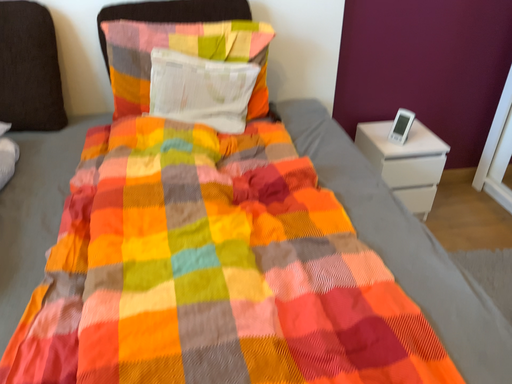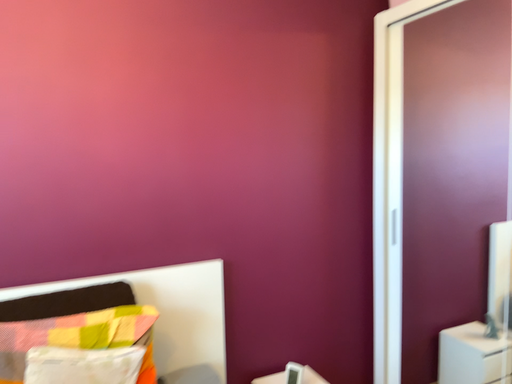
Question: How did the camera likely rotate when shooting the video?

Choices:
 (A) rotated right
 (B) rotated left

Answer: (A)